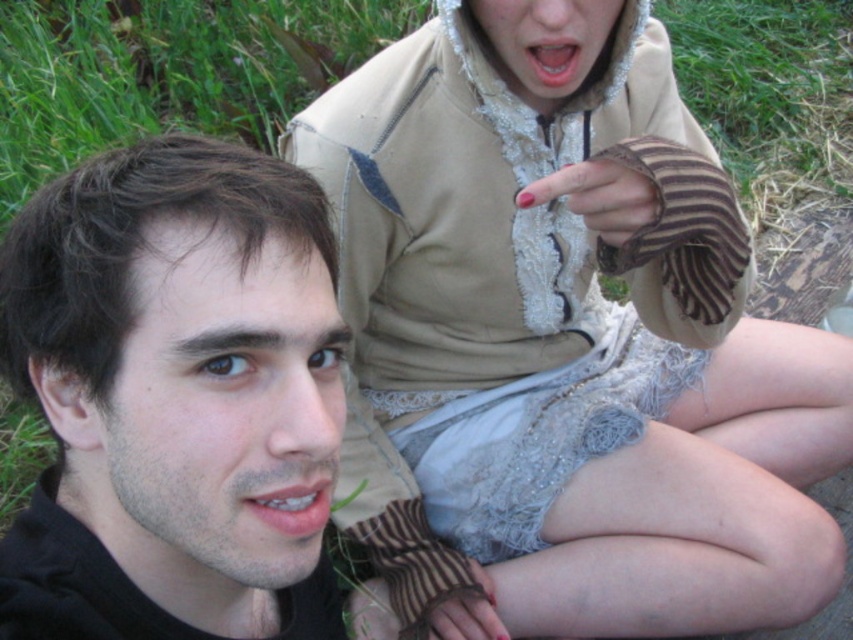
Question: Can you confirm if nail polish at center is wider than smooth skin mouth at center?

Choices:
 (A) yes
 (B) no

Answer: (A)

Question: Which point is closer to the camera?

Choices:
 (A) smooth pink lips at upper center
 (B) smooth black face at center
 (C) smooth skin mouth at center
 (D) light brown textured hoodie at upper center

Answer: (B)

Question: Considering the real-world distances, which object is farthest from the light brown textured hoodie at upper center?

Choices:
 (A) smooth pink lips at upper center
 (B) smooth skin mouth at center
 (C) smooth black face at center

Answer: (B)

Question: Is nail polish at center smaller than smooth pink lips at upper center?

Choices:
 (A) no
 (B) yes

Answer: (A)

Question: Estimate the real-world distances between objects in this image. Which object is closer to the smooth pink lips at upper center?

Choices:
 (A) smooth black face at center
 (B) nail polish at center

Answer: (B)

Question: Can you confirm if light brown textured hoodie at upper center is positioned to the right of smooth skin mouth at center?

Choices:
 (A) no
 (B) yes

Answer: (B)